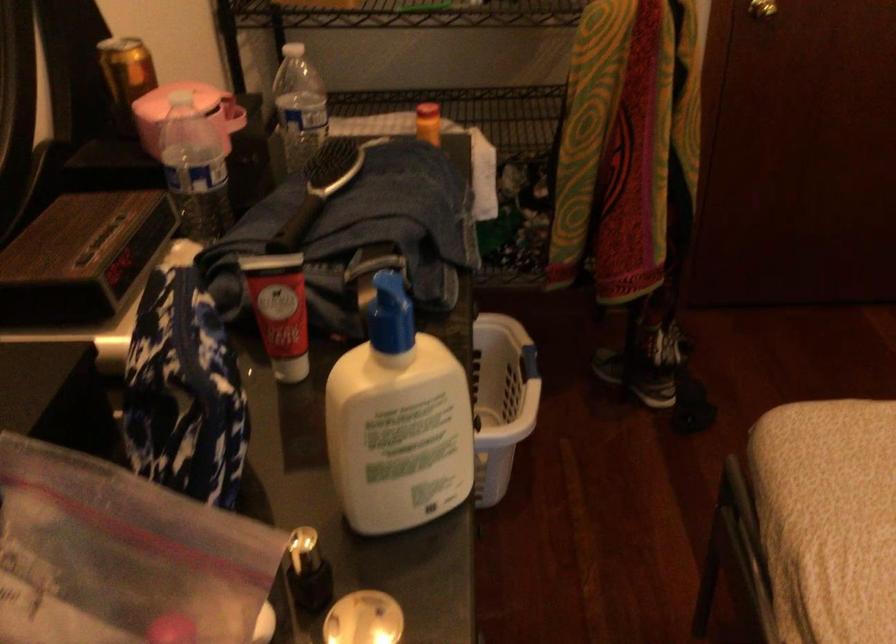
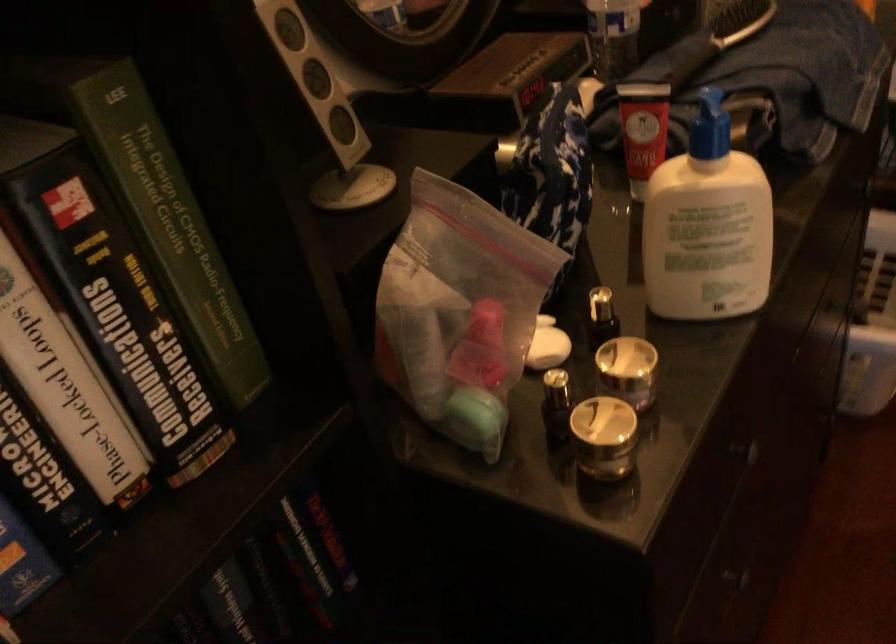
Question: The camera is either moving clockwise (left) or counter-clockwise (right) around the object. The first image is from the beginning of the video and the second image is from the end. Is the camera moving left or right when shooting the video?

Choices:
 (A) Left
 (B) Right

Answer: (B)